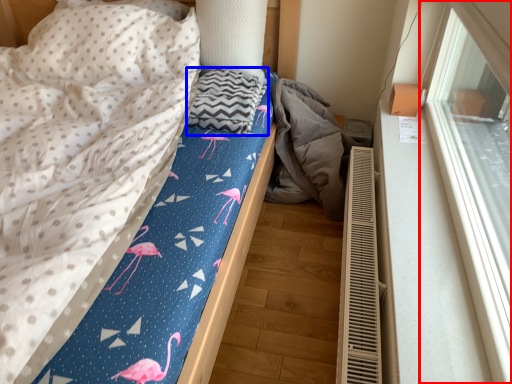
Question: Which object appears closest to the camera in this image, window (highlighted by a red box) or blanket (highlighted by a blue box)?

Choices:
 (A) window
 (B) blanket

Answer: (A)